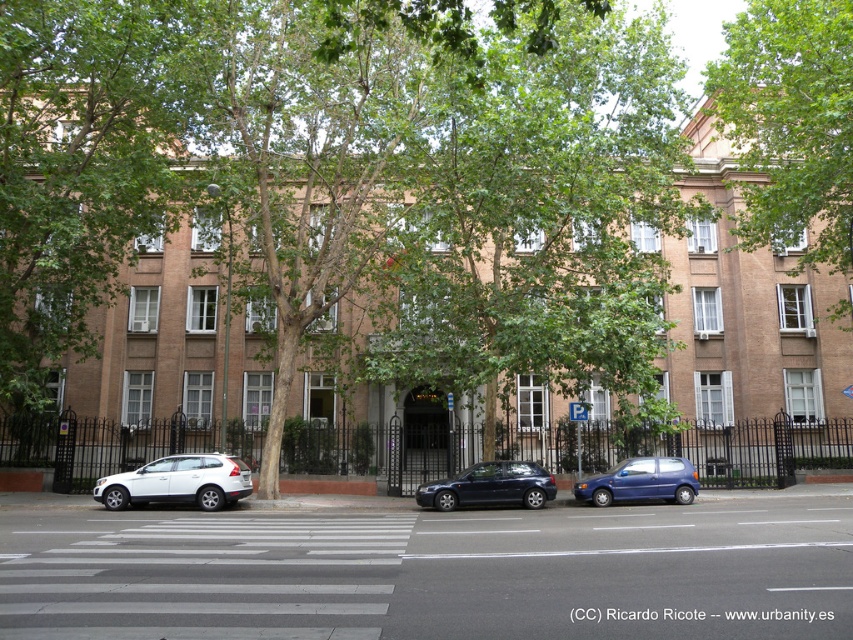
Does green leafy tree at center lie in front of metallic blue hatchback at center?

Yes, it is in front of metallic blue hatchback at center.

Does point (88, 257) come in front of point (640, 474)?

No, (88, 257) is behind (640, 474).

I want to click on green leafy tree at center, so click(83, 164).

The height and width of the screenshot is (640, 853). Describe the element at coordinates (83, 164) in the screenshot. I see `green leafy tree at center` at that location.

Locate an element on the screen. The width and height of the screenshot is (853, 640). green leafy tree at center is located at coordinates (83, 164).

Image resolution: width=853 pixels, height=640 pixels. What are the coordinates of `green leafy tree at center` in the screenshot? It's located at (83, 164).

Between green leafy tree at center and green leafy tree at upper center, which one appears on the right side from the viewer's perspective?

Positioned to the right is green leafy tree at upper center.

Is point (148, 182) farther from camera compared to point (776, 56)?

That is True.

Is point (25, 120) farther from viewer compared to point (741, 90)?

Yes, point (25, 120) is behind point (741, 90).

At what (x,y) coordinates should I click in order to perform the action: click on green leafy tree at center. Please return your answer as a coordinate pair (x, y). This screenshot has width=853, height=640. Looking at the image, I should click on (83, 164).